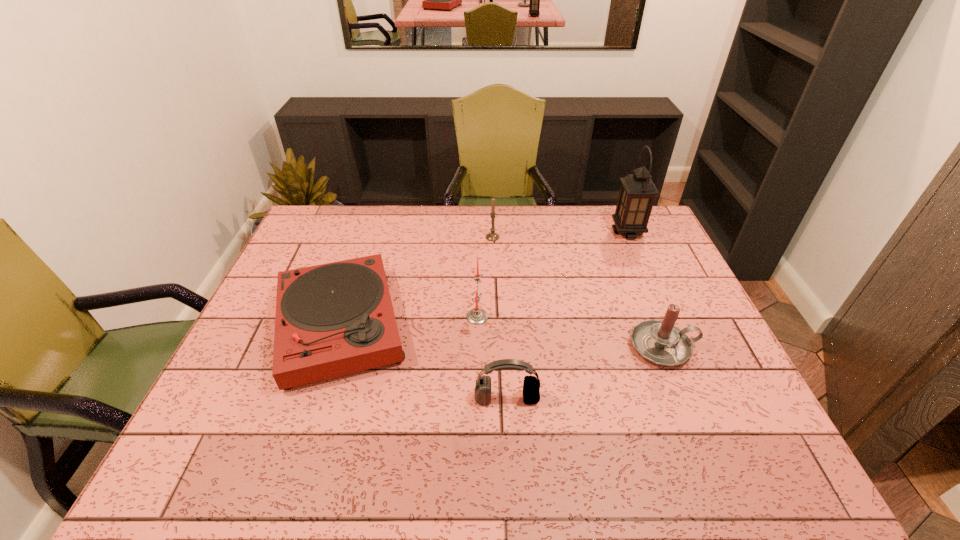
Find the location of a particular element. The height and width of the screenshot is (540, 960). lantern that is at the far edge is located at coordinates (637, 193).

Locate an element on the screen. candle that is at the far edge is located at coordinates (492, 236).

The height and width of the screenshot is (540, 960). Identify the location of object that is at the left edge. (333, 319).

Identify the location of lantern present at the right edge. The width and height of the screenshot is (960, 540). (637, 193).

Image resolution: width=960 pixels, height=540 pixels. In order to click on candle that is at the right edge in this screenshot , I will do `click(660, 342)`.

Locate an element on the screen. The width and height of the screenshot is (960, 540). object that is at the far right corner is located at coordinates (637, 193).

Where is `free space at the far edge of the desktop`? free space at the far edge of the desktop is located at coordinates (378, 219).

Where is `vacant region at the near edge of the desktop`? The image size is (960, 540). vacant region at the near edge of the desktop is located at coordinates (276, 471).

This screenshot has width=960, height=540. In the image, there is a desktop. Find the location of `vacant space at the right edge`. vacant space at the right edge is located at coordinates (679, 286).

The image size is (960, 540). I want to click on vacant space at the far left corner of the desktop, so click(x=312, y=208).